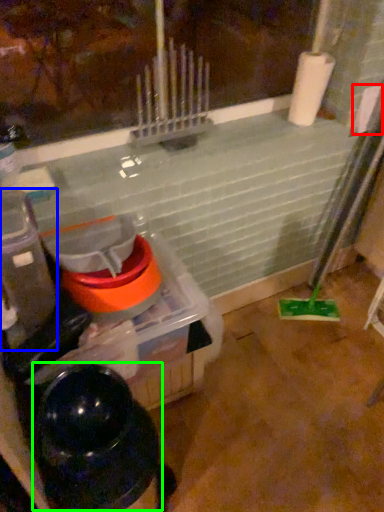
Question: Which is farther away from toilet paper (highlighted by a red box)? appliance (highlighted by a blue box) or water heater (highlighted by a green box)?

Choices:
 (A) appliance
 (B) water heater

Answer: (B)